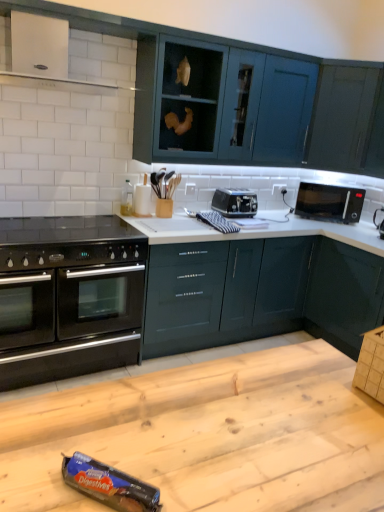
Question: From the image's perspective, is black plastic microwave at upper right, the second appliance in the bottom-to-top sequence, over wooden table at center?

Choices:
 (A) no
 (B) yes

Answer: (B)

Question: Can you confirm if black plastic microwave at upper right, which is the first appliance from right to left, is positioned to the right of wooden table at center?

Choices:
 (A) no
 (B) yes

Answer: (B)

Question: From the image's perspective, is black plastic microwave at upper right, the second appliance viewed from the top, below wooden table at center?

Choices:
 (A) yes
 (B) no

Answer: (B)

Question: Does black plastic microwave at upper right, the 2th appliance when ordered from front to back, appear on the left side of wooden table at center?

Choices:
 (A) yes
 (B) no

Answer: (B)

Question: Can you confirm if black plastic microwave at upper right, the second appliance viewed from the top, is taller than wooden table at center?

Choices:
 (A) yes
 (B) no

Answer: (B)

Question: Relative to blue cardboard digestives at lower center, marked as the 1th appliance in a left-to-right arrangement, is wooden table at center in front or behind?

Choices:
 (A) behind
 (B) front

Answer: (B)

Question: From the image's perspective, is wooden table at center positioned above or below blue cardboard digestives at lower center, the third appliance positioned from the top?

Choices:
 (A) below
 (B) above

Answer: (A)

Question: Would you say wooden table at center is to the left or to the right of blue cardboard digestives at lower center, marked as the 1th appliance in a left-to-right arrangement, in the picture?

Choices:
 (A) left
 (B) right

Answer: (B)

Question: Is point (324, 445) closer or farther from the camera than point (114, 470)?

Choices:
 (A) closer
 (B) farther

Answer: (B)

Question: From the image's perspective, is black glass gas stove at lower left above or below blue cardboard digestives at lower center, marked as the 1th appliance in a left-to-right arrangement?

Choices:
 (A) above
 (B) below

Answer: (A)

Question: Based on their sizes in the image, would you say black glass gas stove at lower left is bigger or smaller than blue cardboard digestives at lower center, marked as the 1th appliance in a left-to-right arrangement?

Choices:
 (A) small
 (B) big

Answer: (B)

Question: Visually, is black glass gas stove at lower left positioned to the left or to the right of blue cardboard digestives at lower center, marked as the third appliance in a back-to-front arrangement?

Choices:
 (A) right
 (B) left

Answer: (B)

Question: From a real-world perspective, is black glass gas stove at lower left physically located above or below blue cardboard digestives at lower center, marked as the third appliance in a back-to-front arrangement?

Choices:
 (A) above
 (B) below

Answer: (A)

Question: Is black glass gas stove at lower left inside or outside of glossy dark teal cabinets at center, which appears as the 3th cabinetry when viewed from the top?

Choices:
 (A) outside
 (B) inside

Answer: (A)

Question: Considering their positions, is black glass gas stove at lower left located in front of or behind glossy dark teal cabinets at center, which appears as the 3th cabinetry when viewed from the top?

Choices:
 (A) behind
 (B) front

Answer: (B)